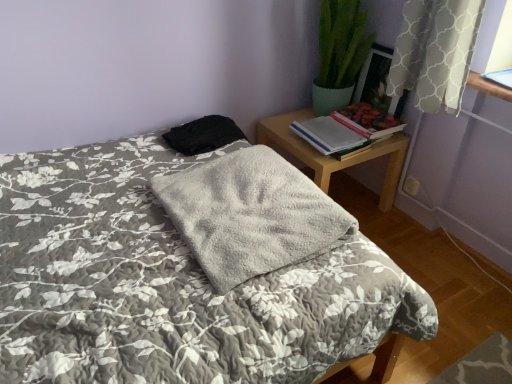
Question: Is white paper book at right, the 2th book from the right, taller or shorter than black fabric at upper center?

Choices:
 (A) tall
 (B) short

Answer: (B)

Question: Considering the positions of white paper book at right, the 2th book from the right, and black fabric at upper center in the image, is white paper book at right, the 2th book from the right, wider or thinner than black fabric at upper center?

Choices:
 (A) thin
 (B) wide

Answer: (A)

Question: Based on their relative distances, which object is farther from the hardcover book at upper right, which is the first book from right to left?

Choices:
 (A) fluffy gray blanket at center
 (B) white paper book at right, the 2th book from the right
 (C) black fabric at upper center
 (D) wooden nightstand at upper right
 (E) gray fluffy blanket at center

Answer: (A)

Question: Which is nearer to the white paper book at right, the first book positioned from the left?

Choices:
 (A) gray fluffy blanket at center
 (B) black fabric at upper center
 (C) hardcover book at upper right, which is the first book from right to left
 (D) wooden nightstand at upper right
 (E) fluffy gray blanket at center

Answer: (C)